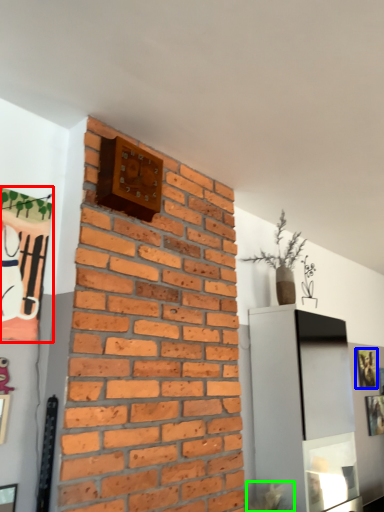
Question: Which object is the farthest from picture frame (highlighted by a red box)? Choose among these: picture frame (highlighted by a blue box) or plant (highlighted by a green box).

Choices:
 (A) picture frame
 (B) plant

Answer: (A)